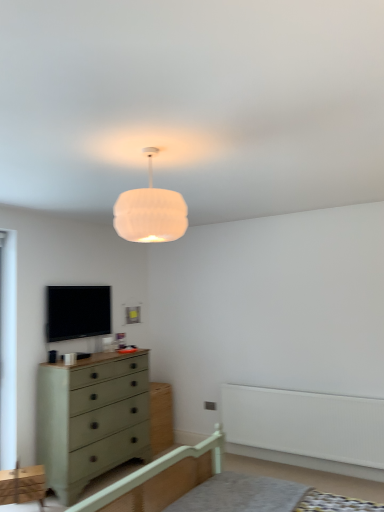
I want to click on vacant point above white plastic balustrade at lower right (from a real-world perspective), so click(x=307, y=386).